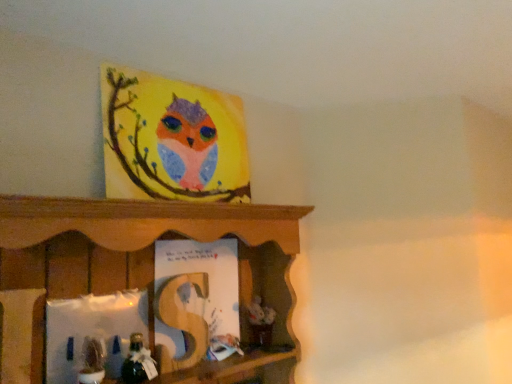
What do you see at coordinates (92, 361) in the screenshot? The width and height of the screenshot is (512, 384). I see `matte green plant at lower left, arranged as the 1th toy when viewed from the left` at bounding box center [92, 361].

Locate an element on the screen. This screenshot has height=384, width=512. shiny metallic toy at lower left, which appears as the first toy when viewed from the right is located at coordinates (138, 362).

Based on their sizes in the image, would you say shiny metallic toy at lower left, which appears as the first toy when viewed from the right, is bigger or smaller than matte green plant at lower left, acting as the second toy starting from the right?

Considering their sizes, shiny metallic toy at lower left, which appears as the first toy when viewed from the right, takes up less space than matte green plant at lower left, acting as the second toy starting from the right.

Which object is closer to the camera taking this photo, shiny metallic toy at lower left, which appears as the first toy when viewed from the right, or matte green plant at lower left, arranged as the 1th toy when viewed from the left?

matte green plant at lower left, arranged as the 1th toy when viewed from the left, is in front.

From the image's perspective, is shiny metallic toy at lower left, which ranks as the second toy in left-to-right order, located above or below matte green plant at lower left, acting as the second toy starting from the right?

shiny metallic toy at lower left, which ranks as the second toy in left-to-right order, is situated lower than matte green plant at lower left, acting as the second toy starting from the right, in the image.

Looking at this image, considering the relative sizes of shiny metallic toy at lower left, which ranks as the second toy in left-to-right order, and matte paper book at center in the image provided, is shiny metallic toy at lower left, which ranks as the second toy in left-to-right order, wider than matte paper book at center?

Yes.

Does point (123, 365) come behind point (167, 258)?

No, it is not.

Considering their positions, is shiny metallic toy at lower left, which appears as the first toy when viewed from the right, located in front of or behind matte paper book at center?

Clearly, shiny metallic toy at lower left, which appears as the first toy when viewed from the right, is in front of matte paper book at center.

Is shiny metallic toy at lower left, which appears as the first toy when viewed from the right, turned away from matte paper book at center?

No, shiny metallic toy at lower left, which appears as the first toy when viewed from the right, is not facing away from matte paper book at center.

Is matte paper book at center situated inside shiny metallic toy at lower left, which appears as the first toy when viewed from the right, or outside?

matte paper book at center is spatially situated outside shiny metallic toy at lower left, which appears as the first toy when viewed from the right.

Is matte paper book at center not close to shiny metallic toy at lower left, which appears as the first toy when viewed from the right?

No, there isn't a large distance between matte paper book at center and shiny metallic toy at lower left, which appears as the first toy when viewed from the right.

Based on the photo, which object is further away from the camera, matte paper book at center or shiny metallic toy at lower left, which appears as the first toy when viewed from the right?

matte paper book at center is further away from the camera.

The width and height of the screenshot is (512, 384). I want to click on the 1st toy in front of the matte paper book at center, so click(x=138, y=362).

Is there a large distance between matte paper book at center and matte green plant at lower left, arranged as the 1th toy when viewed from the left?

No, matte paper book at center is in close proximity to matte green plant at lower left, arranged as the 1th toy when viewed from the left.

Can you tell me how much matte paper book at center and matte green plant at lower left, acting as the second toy starting from the right, differ in facing direction?

0.939 degrees separate the facing orientations of matte paper book at center and matte green plant at lower left, acting as the second toy starting from the right.

Is matte paper book at center turned away from matte green plant at lower left, arranged as the 1th toy when viewed from the left?

matte paper book at center does not have its back to matte green plant at lower left, arranged as the 1th toy when viewed from the left.

Does matte paper book at center have a greater width compared to matte green plant at lower left, acting as the second toy starting from the right?

No.

Considering the sizes of objects matte green plant at lower left, acting as the second toy starting from the right, and shiny metallic toy at lower left, which appears as the first toy when viewed from the right, in the image provided, who is smaller, matte green plant at lower left, acting as the second toy starting from the right, or shiny metallic toy at lower left, which appears as the first toy when viewed from the right,?

With smaller size is shiny metallic toy at lower left, which appears as the first toy when viewed from the right.

Which is correct: matte green plant at lower left, arranged as the 1th toy when viewed from the left, is inside shiny metallic toy at lower left, which appears as the first toy when viewed from the right, or outside of it?

matte green plant at lower left, arranged as the 1th toy when viewed from the left, is not inside shiny metallic toy at lower left, which appears as the first toy when viewed from the right, it's outside.

From the image's perspective, between matte green plant at lower left, arranged as the 1th toy when viewed from the left, and shiny metallic toy at lower left, which ranks as the second toy in left-to-right order, who is located below?

shiny metallic toy at lower left, which ranks as the second toy in left-to-right order.

Can you confirm if matte green plant at lower left, arranged as the 1th toy when viewed from the left, is positioned to the left of matte paper book at center?

Yes, matte green plant at lower left, arranged as the 1th toy when viewed from the left, is to the left of matte paper book at center.

Who is taller, matte green plant at lower left, acting as the second toy starting from the right, or matte paper book at center?

matte paper book at center.

Is matte green plant at lower left, arranged as the 1th toy when viewed from the left, smaller than matte paper book at center?

Indeed, matte green plant at lower left, arranged as the 1th toy when viewed from the left, has a smaller size compared to matte paper book at center.

The width and height of the screenshot is (512, 384). I want to click on book that appears on the right of matte green plant at lower left, acting as the second toy starting from the right, so click(x=195, y=301).

In the image, there is a matte green plant at lower left, arranged as the 1th toy when viewed from the left. Find the location of `toy below it (from a real-world perspective)`. toy below it (from a real-world perspective) is located at coordinates (138, 362).

Where is `toy that is the 1st object to the left of the matte paper book at center, starting at the anchor`? The width and height of the screenshot is (512, 384). toy that is the 1st object to the left of the matte paper book at center, starting at the anchor is located at coordinates (138, 362).

Which object lies further to the anchor point matte green plant at lower left, acting as the second toy starting from the right, shiny metallic toy at lower left, which ranks as the second toy in left-to-right order, or matte paper book at center?

matte paper book at center is positioned further to the anchor matte green plant at lower left, acting as the second toy starting from the right.

Which object lies further to the anchor point shiny metallic toy at lower left, which ranks as the second toy in left-to-right order, matte paper book at center or matte green plant at lower left, acting as the second toy starting from the right?

The object further to shiny metallic toy at lower left, which ranks as the second toy in left-to-right order, is matte paper book at center.

When comparing their distances from matte green plant at lower left, acting as the second toy starting from the right, does matte paper book at center or shiny metallic toy at lower left, which appears as the first toy when viewed from the right, seem closer?

shiny metallic toy at lower left, which appears as the first toy when viewed from the right, is positioned closer to the anchor matte green plant at lower left, acting as the second toy starting from the right.

Estimate the real-world distances between objects in this image. Which object is closer to matte paper book at center, shiny metallic toy at lower left, which ranks as the second toy in left-to-right order, or matte green plant at lower left, acting as the second toy starting from the right?

Among the two, shiny metallic toy at lower left, which ranks as the second toy in left-to-right order, is located nearer to matte paper book at center.

Considering their positions, is matte green plant at lower left, acting as the second toy starting from the right, positioned further to shiny metallic toy at lower left, which ranks as the second toy in left-to-right order, than matte paper book at center?

Based on the image, matte paper book at center appears to be further to shiny metallic toy at lower left, which ranks as the second toy in left-to-right order.

Looking at the image, which one is located closer to matte paper book at center, matte green plant at lower left, acting as the second toy starting from the right, or shiny metallic toy at lower left, which ranks as the second toy in left-to-right order?

shiny metallic toy at lower left, which ranks as the second toy in left-to-right order, is closer to matte paper book at center.

I want to click on toy between matte green plant at lower left, acting as the second toy starting from the right, and matte paper book at center, along the z-axis, so click(138, 362).